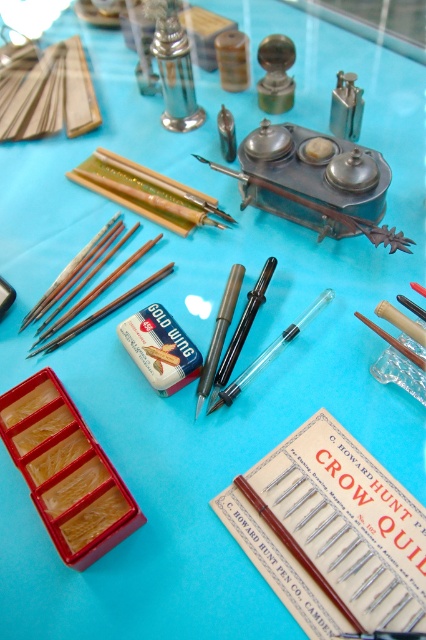
Question: Among these points, which one is farthest from the camera?

Choices:
 (A) (302, 225)
 (B) (28, 316)

Answer: (A)

Question: Does satin silver inkwell at center appear under matte black paint brush at center?

Choices:
 (A) yes
 (B) no

Answer: (B)

Question: Considering the relative positions of satin silver inkwell at center and matte black paint brush at center in the image provided, where is satin silver inkwell at center located with respect to matte black paint brush at center?

Choices:
 (A) right
 (B) left

Answer: (A)

Question: Which object is closer to the camera taking this photo?

Choices:
 (A) brown wood paint brush at center-left
 (B) transparent plastic paint brush at center

Answer: (B)

Question: Considering the relative positions of transparent plastic paint brush at center and matte black paint brush at center in the image provided, where is transparent plastic paint brush at center located with respect to matte black paint brush at center?

Choices:
 (A) below
 (B) above

Answer: (A)

Question: Estimate the real-world distances between objects in this image. Which object is closer to the matte black paint brush at center?

Choices:
 (A) brown wood paint brush at center-left
 (B) transparent plastic paint brush at center

Answer: (B)